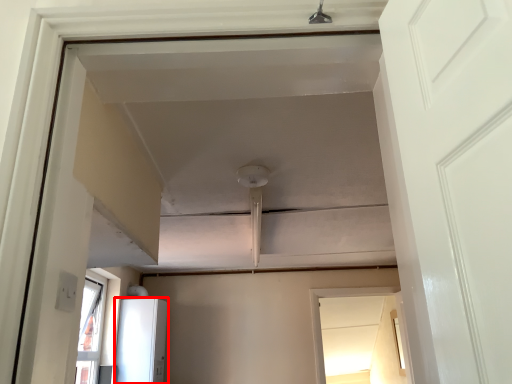
Question: From the image's perspective, where is appliance (annotated by the red box) located relative to window?

Choices:
 (A) above
 (B) below

Answer: (A)